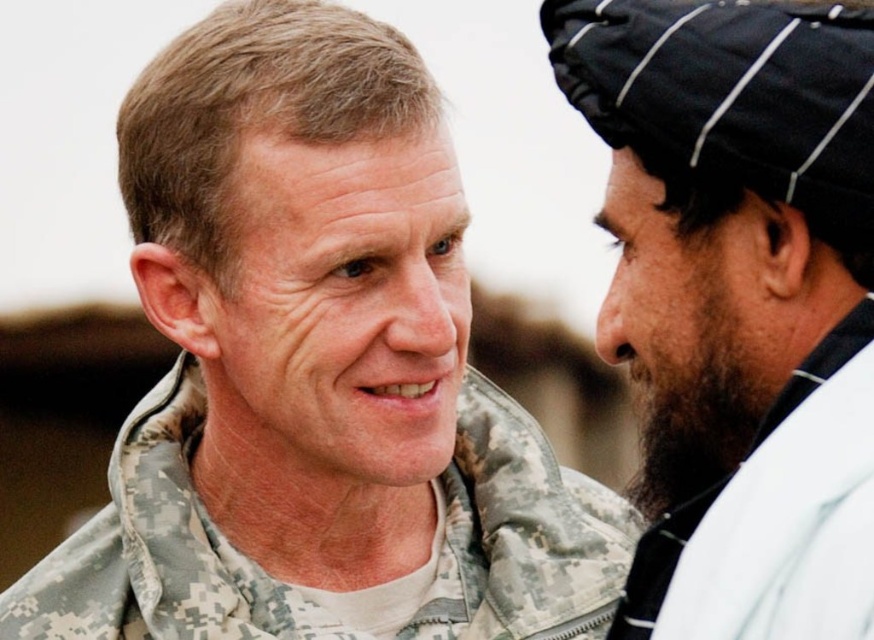
Does camouflage jacket at center appear over camouflage fabric jacket at center?

Yes, camouflage jacket at center is above camouflage fabric jacket at center.

Does point (281, 285) come in front of point (272, 637)?

Yes.

You are a GUI agent. You are given a task and a screenshot of the screen. Output one action in this format:
    pyautogui.click(x=<x>, y=<y>)
    Task: Click on the camouflage jacket at center
    The height and width of the screenshot is (640, 874).
    Given the screenshot: What is the action you would take?
    pyautogui.click(x=316, y=372)

Is camouflage jacket at center to the right of black fabric beard at right from the viewer's perspective?

Incorrect, camouflage jacket at center is not on the right side of black fabric beard at right.

Locate an element on the screen. camouflage jacket at center is located at coordinates (316, 372).

Does point (361, 636) come farther from viewer compared to point (649, 532)?

Yes, it is.

Locate an element on the screen. camouflage jacket at center is located at coordinates point(316,372).

Is point (619, 636) farther from viewer compared to point (551, 576)?

No, (619, 636) is closer to viewer.

Does black woven turban at right have a greater height compared to camouflage fabric jacket at center?

Indeed, black woven turban at right has a greater height compared to camouflage fabric jacket at center.

Is point (637, 378) positioned behind point (351, 637)?

That is False.

At what (x,y) coordinates should I click in order to perform the action: click on black woven turban at right. Please return your answer as a coordinate pair (x, y). This screenshot has height=640, width=874. Looking at the image, I should click on (739, 301).